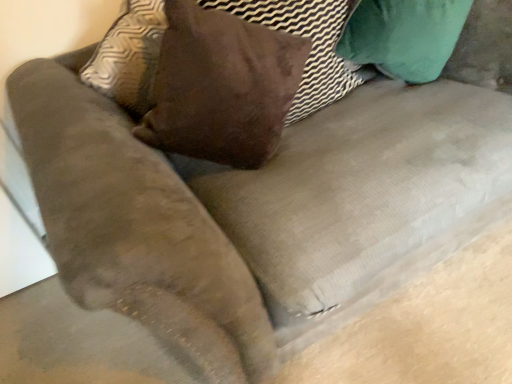
This screenshot has height=384, width=512. Describe the element at coordinates (311, 48) in the screenshot. I see `suede brown pillow at center` at that location.

Find the location of a particular element. suede brown pillow at center is located at coordinates (311, 48).

In order to face suede brown pillow at center, should I rotate leftwards or rightwards?

A 4.571 degree turn to the right will do.

Image resolution: width=512 pixels, height=384 pixels. I want to click on brown suede pillow at upper center, so click(x=221, y=87).

Describe the element at coordinates (221, 87) in the screenshot. I see `brown suede pillow at upper center` at that location.

Locate an element on the screen. This screenshot has height=384, width=512. suede brown pillow at center is located at coordinates (311, 48).

Can you confirm if suede brown pillow at center is positioned to the right of brown suede pillow at upper center?

Correct, you'll find suede brown pillow at center to the right of brown suede pillow at upper center.

Relative to brown suede pillow at upper center, is suede brown pillow at center in front or behind?

Clearly, suede brown pillow at center is behind brown suede pillow at upper center.

Considering the points (302, 75) and (264, 41), which point is behind, point (302, 75) or point (264, 41)?

Positioned behind is point (302, 75).

From the image's perspective, between suede brown pillow at center and brown suede pillow at upper center, which one is located above?

brown suede pillow at upper center, from the image's perspective.

From a real-world perspective, is suede brown pillow at center physically located above or below brown suede pillow at upper center?

From a real-world perspective, suede brown pillow at center is physically below brown suede pillow at upper center.

Considering the sizes of suede brown pillow at center and brown suede pillow at upper center in the image, is suede brown pillow at center wider or thinner than brown suede pillow at upper center?

Clearly, suede brown pillow at center has less width compared to brown suede pillow at upper center.

In terms of height, does suede brown pillow at center look taller or shorter compared to brown suede pillow at upper center?

Considering their sizes, suede brown pillow at center has less height than brown suede pillow at upper center.

Considering the sizes of suede brown pillow at center and brown suede pillow at upper center in the image, is suede brown pillow at center bigger or smaller than brown suede pillow at upper center?

Considering their sizes, suede brown pillow at center takes up less space than brown suede pillow at upper center.

Would you say suede brown pillow at center is outside brown suede pillow at upper center?

Yes, suede brown pillow at center is outside of brown suede pillow at upper center.

Are suede brown pillow at center and brown suede pillow at upper center located far from each other?

No.

Is suede brown pillow at center turned away from brown suede pillow at upper center?

Yes, brown suede pillow at upper center is at the back of suede brown pillow at center.

How many degrees apart are the facing directions of suede brown pillow at center and brown suede pillow at upper center?

The angular difference between suede brown pillow at center and brown suede pillow at upper center is 10.2 degrees.

How much distance is there between suede brown pillow at center and brown suede pillow at upper center?

suede brown pillow at center is 7.68 inches from brown suede pillow at upper center.

You are a GUI agent. You are given a task and a screenshot of the screen. Output one action in this format:
    pyautogui.click(x=<x>, y=<y>)
    Task: Click on the throw pillow above the suede brown pillow at center (from a real-world perspective)
    
    Given the screenshot: What is the action you would take?
    pyautogui.click(x=221, y=87)

Is brown suede pillow at upper center to the left or to the right of suede brown pillow at center in the image?

brown suede pillow at upper center is to the left of suede brown pillow at center.

Is the position of brown suede pillow at upper center less distant than that of suede brown pillow at center?

That is True.

Which is nearer, (252, 132) or (266, 3)?

Point (252, 132).

Based on the photo, from the image's perspective, is brown suede pillow at upper center positioned above or below suede brown pillow at center?

brown suede pillow at upper center is situated higher than suede brown pillow at center in the image.

From a real-world perspective, between brown suede pillow at upper center and suede brown pillow at center, who is vertically higher?

brown suede pillow at upper center.

Which of these two, brown suede pillow at upper center or suede brown pillow at center, is thinner?

Thinner between the two is suede brown pillow at center.

Considering the relative sizes of brown suede pillow at upper center and suede brown pillow at center in the image provided, is brown suede pillow at upper center taller than suede brown pillow at center?

Correct, brown suede pillow at upper center is much taller as suede brown pillow at center.

Can you confirm if brown suede pillow at upper center is smaller than suede brown pillow at center?

Incorrect, brown suede pillow at upper center is not smaller in size than suede brown pillow at center.

Is brown suede pillow at upper center surrounding suede brown pillow at center?

No, brown suede pillow at upper center does not contain suede brown pillow at center.

Is brown suede pillow at upper center not close to suede brown pillow at center?

No.

Is brown suede pillow at upper center aimed at suede brown pillow at center?

Yes, brown suede pillow at upper center is aimed at suede brown pillow at center.

How many degrees apart are the facing directions of brown suede pillow at upper center and suede brown pillow at center?

The angle between the facing direction of brown suede pillow at upper center and the facing direction of suede brown pillow at center is 10.2 degrees.

Image resolution: width=512 pixels, height=384 pixels. I want to click on throw pillow above the suede brown pillow at center (from the image's perspective), so click(221, 87).

This screenshot has height=384, width=512. What are the coordinates of `pillow below the brown suede pillow at upper center (from the image's perspective)` in the screenshot? It's located at (311, 48).

You are a GUI agent. You are given a task and a screenshot of the screen. Output one action in this format:
    pyautogui.click(x=<x>, y=<y>)
    Task: Click on the throw pillow located above the suede brown pillow at center (from a real-world perspective)
    
    Given the screenshot: What is the action you would take?
    pyautogui.click(x=221, y=87)